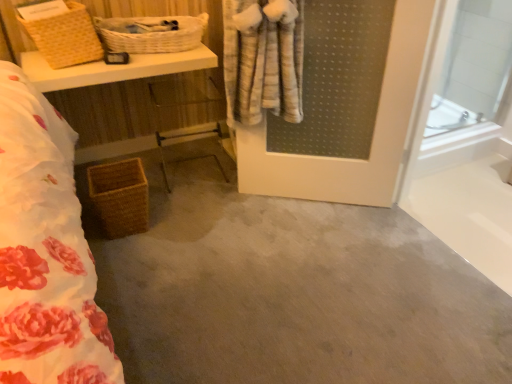
Where is `vacant area that lies in front of woven wicker basket at lower left`? vacant area that lies in front of woven wicker basket at lower left is located at coordinates (162, 241).